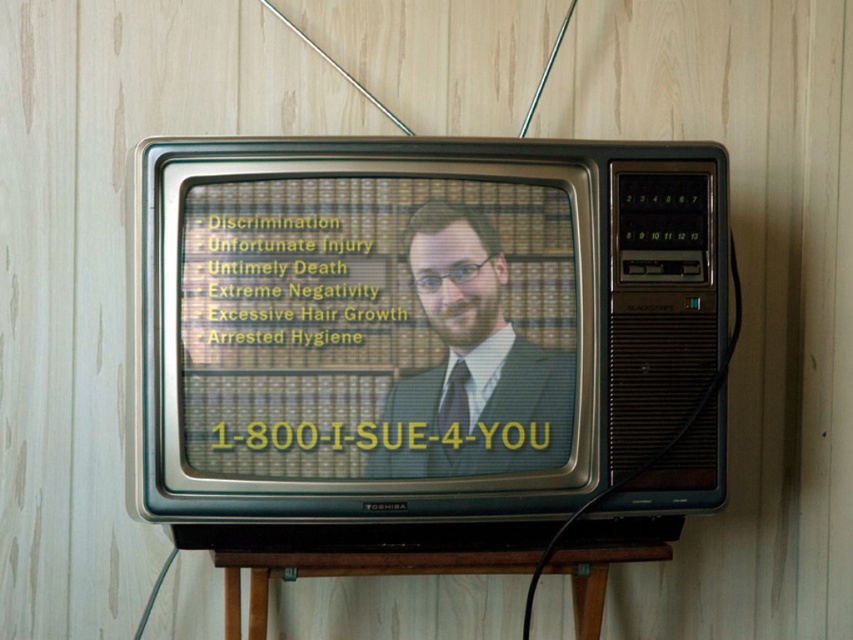
Question: Among these objects, which one is farthest from the camera?

Choices:
 (A) matte black suit at center
 (B) yellow text on crt screen at center

Answer: (A)

Question: Among these objects, which one is farthest from the camera?

Choices:
 (A) matte black suit at center
 (B) yellow text on crt screen at center

Answer: (A)

Question: Does yellow text on crt screen at center have a smaller size compared to matte black suit at center?

Choices:
 (A) yes
 (B) no

Answer: (B)

Question: Does yellow text on crt screen at center appear on the left side of matte black suit at center?

Choices:
 (A) no
 (B) yes

Answer: (B)

Question: Is yellow text on crt screen at center behind matte black suit at center?

Choices:
 (A) yes
 (B) no

Answer: (B)